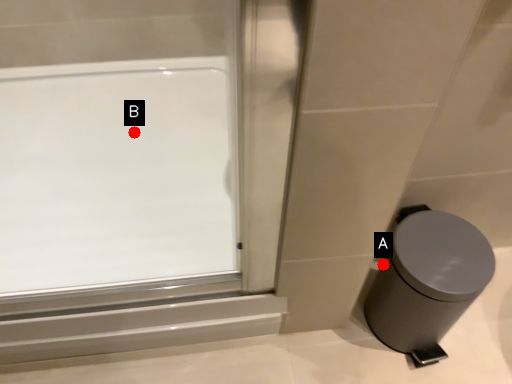
Question: Two points are circled on the image, labeled by A and B beside each circle. Which point is farther to the camera?

Choices:
 (A) A is further
 (B) B is further

Answer: (B)